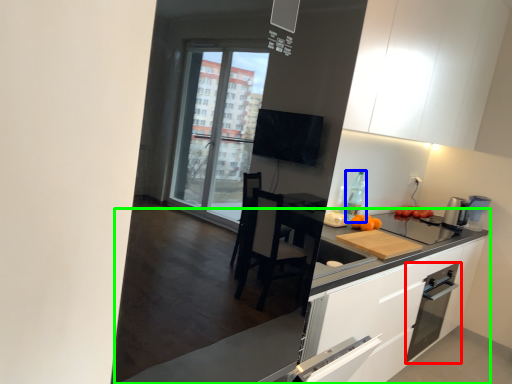
Question: Which is farther away from kitchen appliance (highlighted by a red box)? bottle (highlighted by a blue box) or countertop (highlighted by a green box)?

Choices:
 (A) bottle
 (B) countertop

Answer: (B)